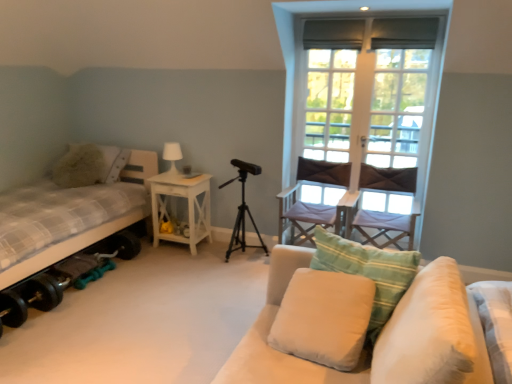
Question: From the image's perspective, is white soft cushion at center, which is the second pillow from left to right, above or below light purple fabric chair at center right, acting as the first chair starting from the right?

Choices:
 (A) above
 (B) below

Answer: (B)

Question: Considering their positions, is white soft cushion at center, arranged as the second pillow when viewed from the front, located in front of or behind light purple fabric chair at center right, acting as the first chair starting from the right?

Choices:
 (A) behind
 (B) front

Answer: (B)

Question: Considering the real-world distances, which object is closest to the soft beige fabric couch at lower right?

Choices:
 (A) white wood screen door at upper right
 (B) white soft pillow at lower right, marked as the 4th pillow in a left-to-right arrangement
 (C) white wood window at upper right
 (D) checkered fabric bed at left
 (E) dark brown fabric chair at center, which appears as the 2th chair when viewed from the right

Answer: (B)

Question: Which object is the farthest from the black matte tripod at center?

Choices:
 (A) light beige fabric pillow at center, which appears as the 2th pillow when viewed from the right
 (B) soft beige fabric couch at lower right
 (C) white soft pillow at lower right, which is the first pillow from front to back
 (D) fluffy beige pillow at left, which ranks as the 4th pillow in right-to-left order
 (E) dark brown fabric chair at center, the first chair positioned from the left

Answer: (C)